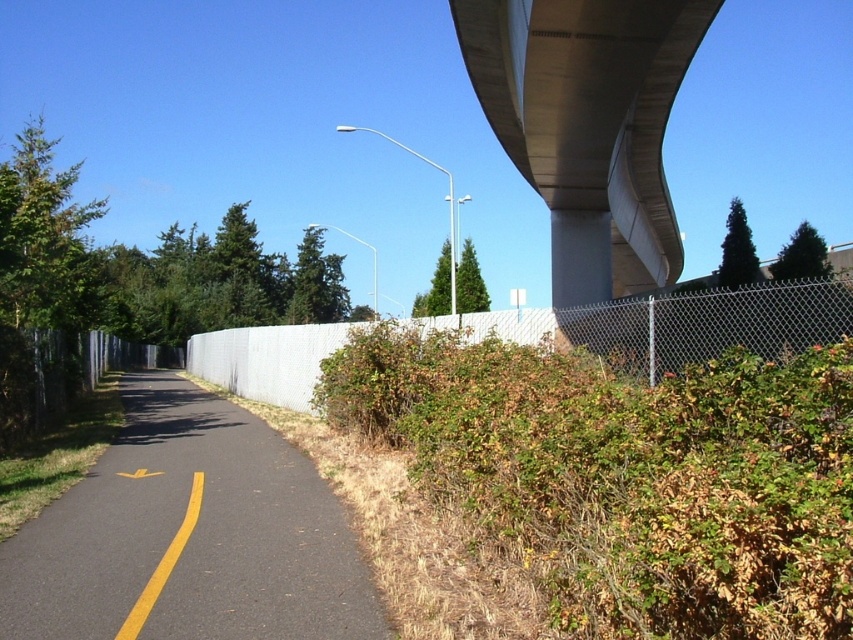
Can you confirm if yellow asphalt highway at lower left is smaller than white chain-link fence at center?

Correct, yellow asphalt highway at lower left occupies less space than white chain-link fence at center.

Which is below, yellow asphalt highway at lower left or white chain-link fence at center?

yellow asphalt highway at lower left is lower down.

This screenshot has height=640, width=853. What do you see at coordinates (189, 536) in the screenshot?
I see `yellow asphalt highway at lower left` at bounding box center [189, 536].

The height and width of the screenshot is (640, 853). Find the location of `yellow asphalt highway at lower left`. yellow asphalt highway at lower left is located at coordinates (189, 536).